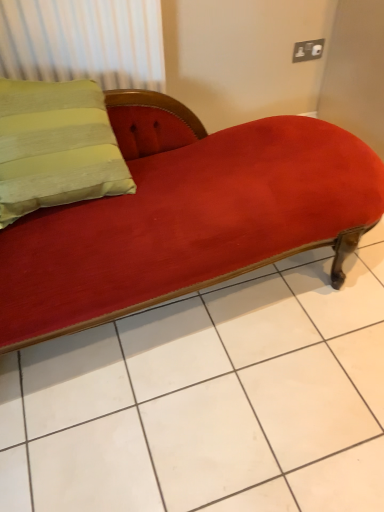
Measure the distance between point (151, 80) and camera.

1.57 meters.

The image size is (384, 512). What do you see at coordinates (83, 42) in the screenshot?
I see `green fabric at upper left` at bounding box center [83, 42].

Image resolution: width=384 pixels, height=512 pixels. What are the coordinates of `green fabric at upper left` in the screenshot? It's located at (83, 42).

Find the location of a particular element. This screenshot has width=384, height=512. green fabric at upper left is located at coordinates (83, 42).